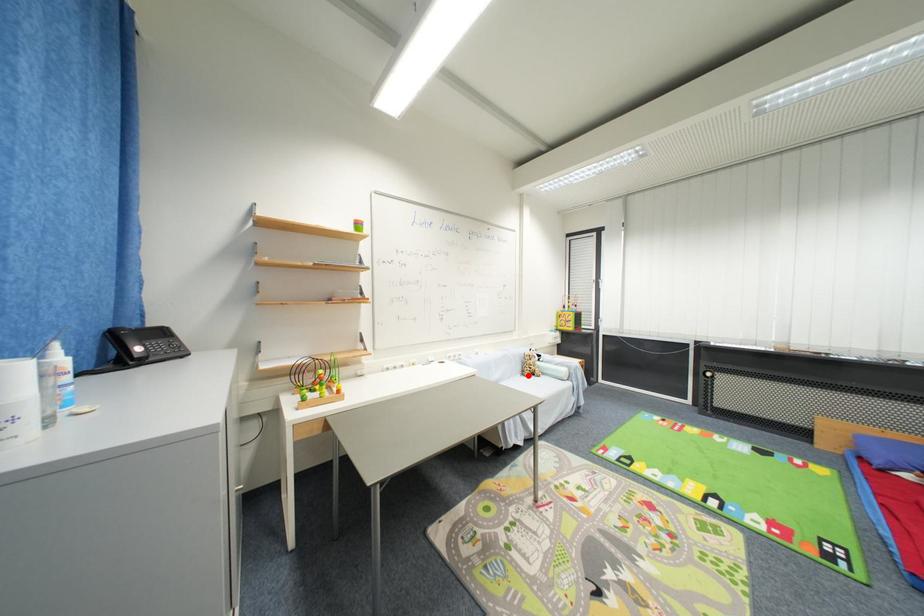
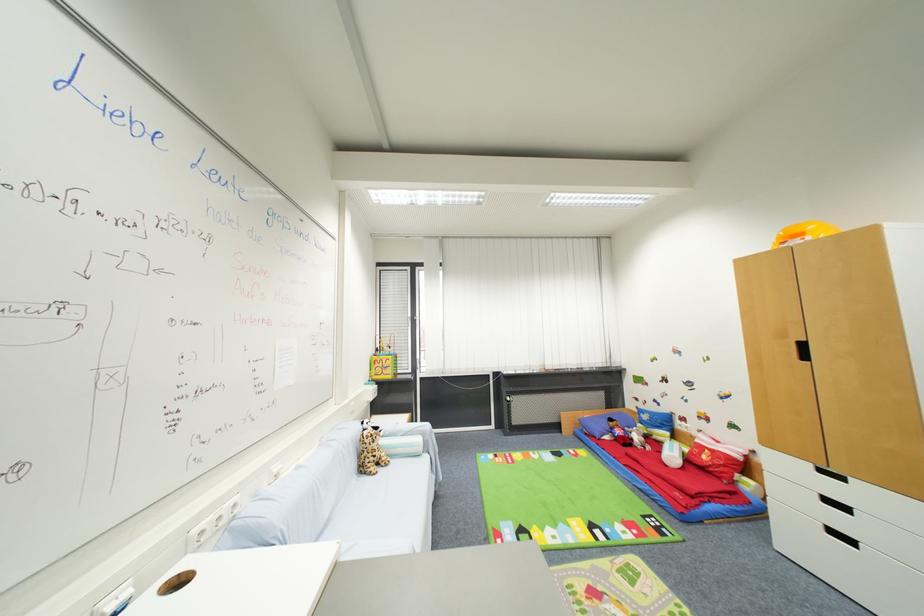
Question: A red point is marked in image1. In image2, is the corresponding 3D point closer to the camera or farther? Reply with the corresponding letter.

Choices:
 (A) The corresponding 3D point is closer.
 (B) The corresponding 3D point is farther.

Answer: (B)